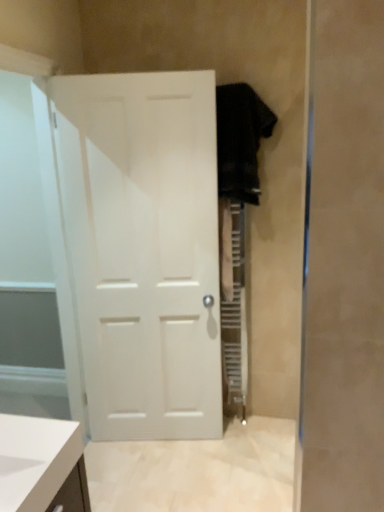
This screenshot has height=512, width=384. Identify the location of vacant space in black fabric robe at right (from a real-world perspective). (255, 423).